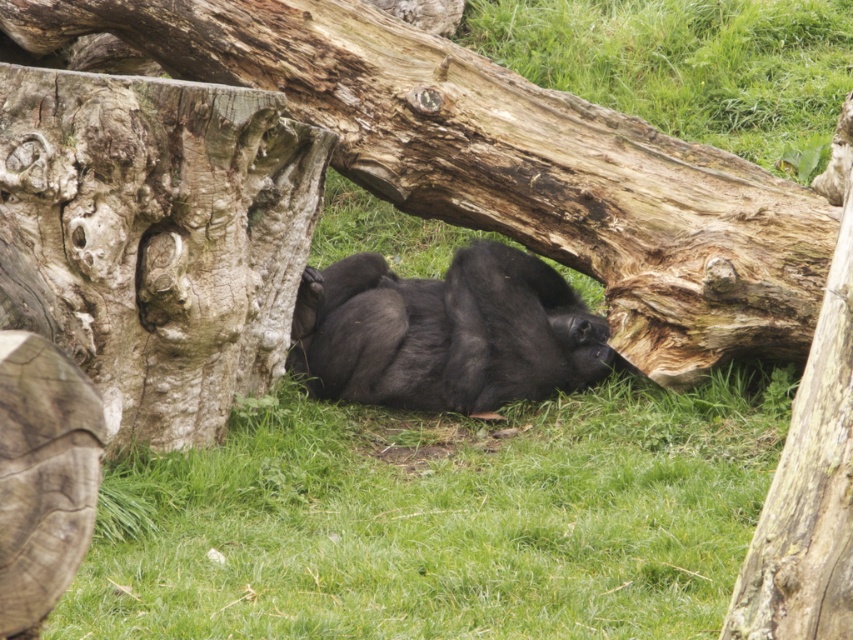
Between green grass at lower center and smooth brown log at center, which one is positioned higher?

smooth brown log at center is above.

Is point (762, 448) in front of point (576, 168)?

Yes, it is.

Identify the location of green grass at lower center. Image resolution: width=853 pixels, height=640 pixels. (440, 518).

How far apart are smooth brown log at center and black fur gorilla at center?

smooth brown log at center and black fur gorilla at center are 20.48 inches apart from each other.

Is smooth brown log at center above black fur gorilla at center?

Yes.

Image resolution: width=853 pixels, height=640 pixels. I want to click on smooth brown log at center, so click(509, 164).

Is smooth brown log at center in front of rough bark tree trunk at left?

No, it is not.

Which is more to the left, smooth brown log at center or rough bark tree trunk at left?

rough bark tree trunk at left

Who is more distant from viewer, (660, 291) or (154, 100)?

The point (660, 291) is more distant.

Locate an element on the screen. This screenshot has height=640, width=853. smooth brown log at center is located at coordinates (509, 164).